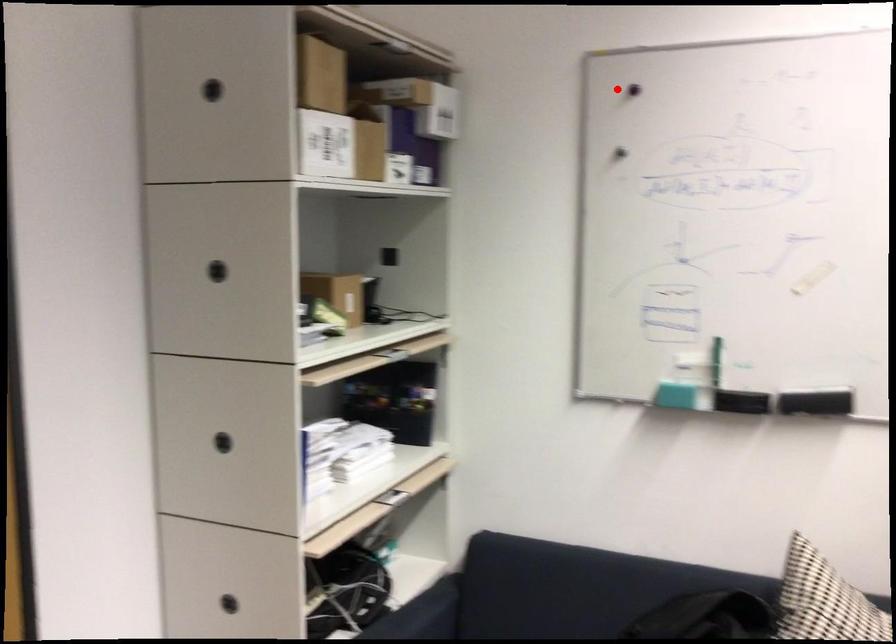
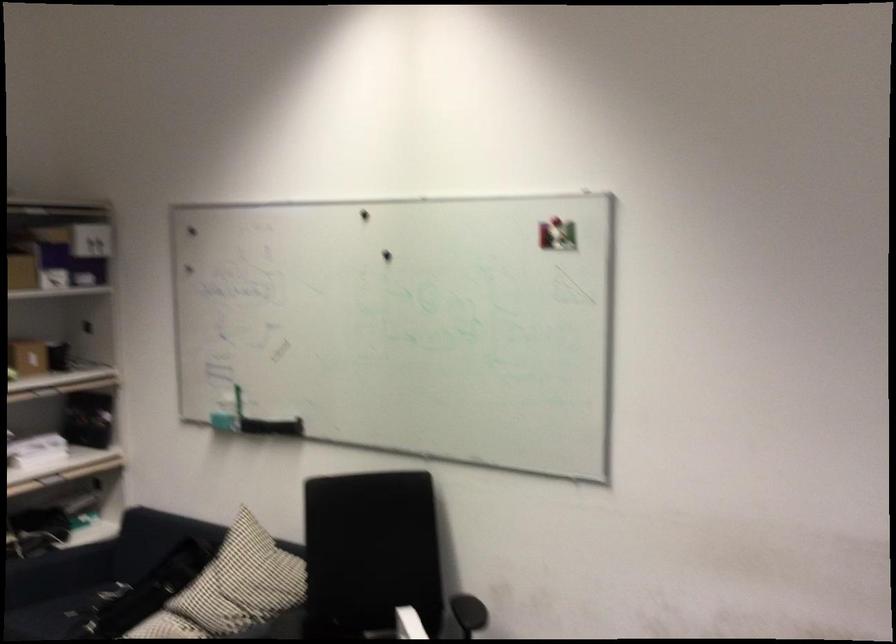
Where in the second image is the point corresponding to the highlighted location from the first image?

(192, 231)